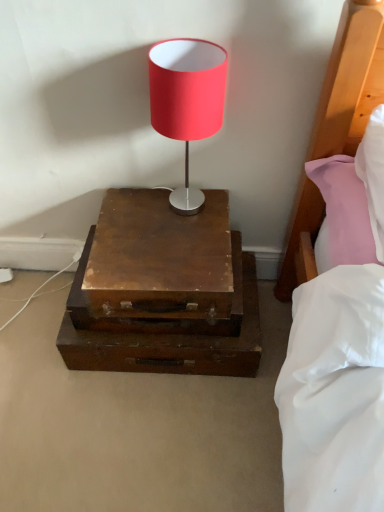
Question: Considering the relative sizes of matte red lampshade at center and wooden nightstand at center in the image provided, is matte red lampshade at center wider than wooden nightstand at center?

Choices:
 (A) yes
 (B) no

Answer: (B)

Question: Is matte red lampshade at center thinner than wooden nightstand at center?

Choices:
 (A) yes
 (B) no

Answer: (A)

Question: Considering the relative positions of matte red lampshade at center and wooden nightstand at center in the image provided, is matte red lampshade at center to the right of wooden nightstand at center from the viewer's perspective?

Choices:
 (A) no
 (B) yes

Answer: (B)

Question: Could wooden nightstand at center be considered to be inside matte red lampshade at center?

Choices:
 (A) yes
 (B) no

Answer: (B)

Question: Can we say matte red lampshade at center lies outside wooden nightstand at center?

Choices:
 (A) yes
 (B) no

Answer: (A)

Question: Is matte red lampshade at center bigger than wooden nightstand at center?

Choices:
 (A) yes
 (B) no

Answer: (B)

Question: Is wooden nightstand at center facing away from matte red lampshade at center?

Choices:
 (A) no
 (B) yes

Answer: (A)

Question: From the image's perspective, is wooden nightstand at center under matte red lampshade at center?

Choices:
 (A) no
 (B) yes

Answer: (B)

Question: From the image's perspective, does wooden nightstand at center appear higher than matte red lampshade at center?

Choices:
 (A) yes
 (B) no

Answer: (B)

Question: Is wooden nightstand at center far from matte red lampshade at center?

Choices:
 (A) no
 (B) yes

Answer: (A)

Question: Is wooden nightstand at center bigger than matte red lampshade at center?

Choices:
 (A) no
 (B) yes

Answer: (B)

Question: Is wooden nightstand at center further to the viewer compared to matte red lampshade at center?

Choices:
 (A) yes
 (B) no

Answer: (A)

Question: Does wooden drawer at center have a lesser height compared to matte red lampshade at center?

Choices:
 (A) no
 (B) yes

Answer: (B)